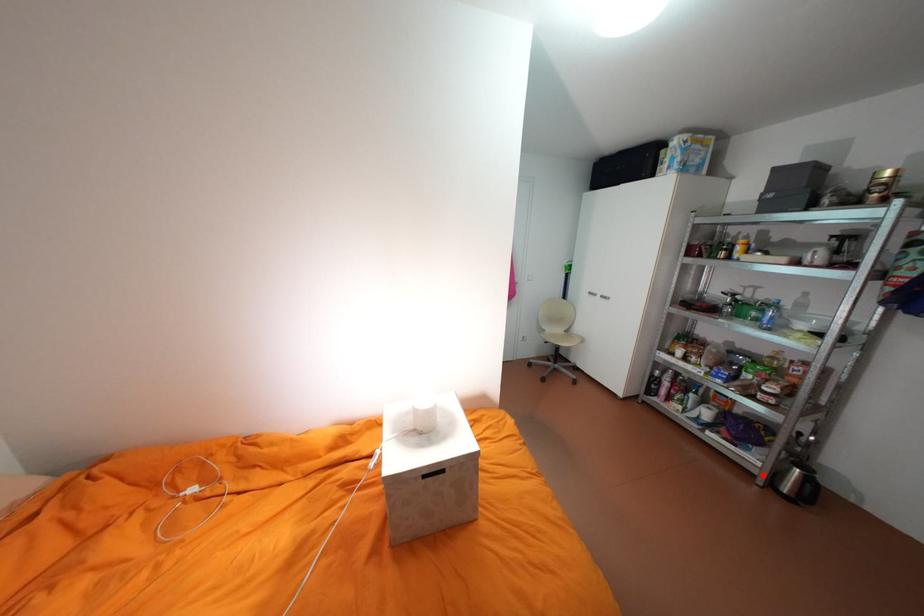
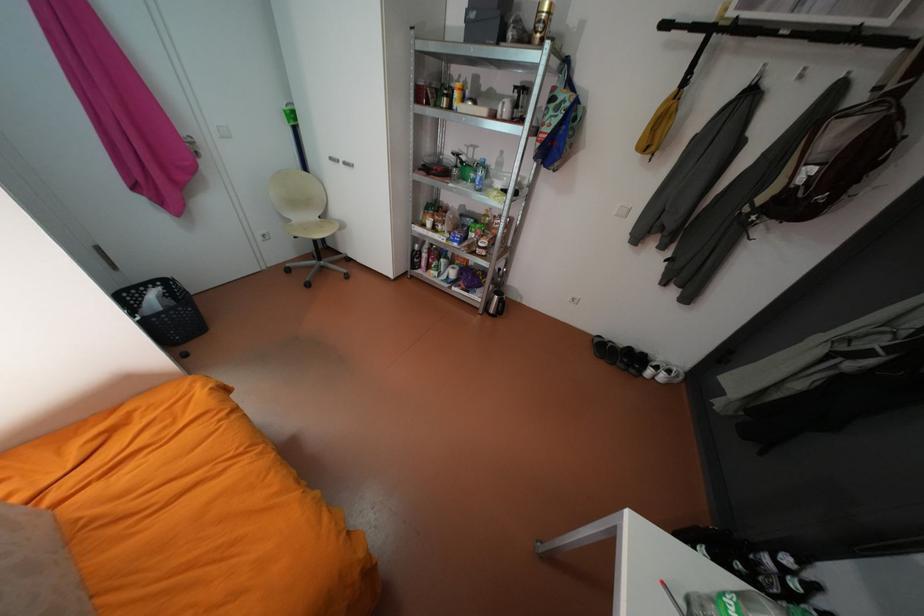
In the second image, find the point that corresponds to the highlighted location in the first image.

(487, 308)